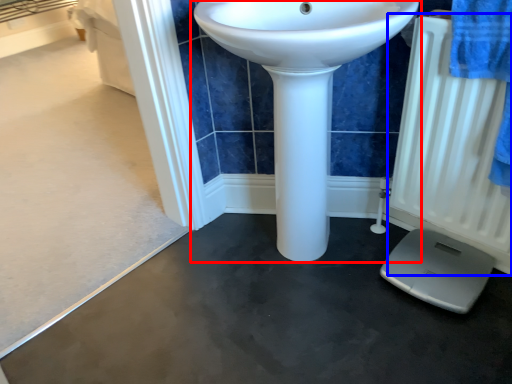
Question: Which object appears closest to the camera in this image, sink (highlighted by a red box) or radiator (highlighted by a blue box)?

Choices:
 (A) sink
 (B) radiator

Answer: (A)